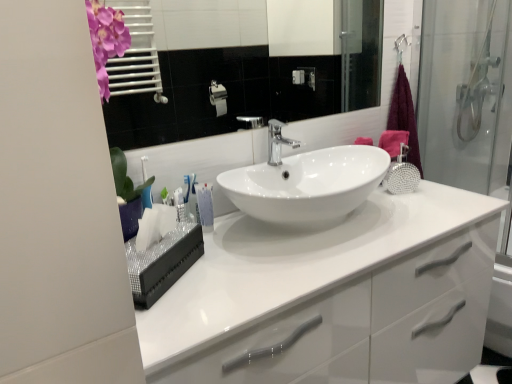
Question: Can you confirm if pink fabric bath towel at upper right is positioned to the left of white glossy cabinet at center?

Choices:
 (A) no
 (B) yes

Answer: (A)

Question: Is the depth of pink fabric bath towel at upper right less than that of white glossy cabinet at center?

Choices:
 (A) no
 (B) yes

Answer: (A)

Question: From the image's perspective, is pink fabric bath towel at upper right located above white glossy cabinet at center?

Choices:
 (A) yes
 (B) no

Answer: (A)

Question: From a real-world perspective, is pink fabric bath towel at upper right on top of white glossy cabinet at center?

Choices:
 (A) yes
 (B) no

Answer: (A)

Question: Can you confirm if pink fabric bath towel at upper right is taller than white glossy cabinet at center?

Choices:
 (A) no
 (B) yes

Answer: (A)

Question: Is pink fabric bath towel at upper right oriented away from white glossy cabinet at center?

Choices:
 (A) no
 (B) yes

Answer: (A)

Question: Can you confirm if white glossy tube at center is bigger than pink fabric bath towel at upper right?

Choices:
 (A) no
 (B) yes

Answer: (A)

Question: Could you tell me if white glossy tube at center is facing pink fabric bath towel at upper right?

Choices:
 (A) no
 (B) yes

Answer: (A)

Question: Is pink fabric bath towel at upper right surrounded by white glossy tube at center?

Choices:
 (A) no
 (B) yes

Answer: (A)

Question: Is white glossy tube at center placed right next to pink fabric bath towel at upper right?

Choices:
 (A) yes
 (B) no

Answer: (B)

Question: Can you confirm if white glossy tube at center is smaller than pink fabric bath towel at upper right?

Choices:
 (A) yes
 (B) no

Answer: (A)

Question: Does white glossy tube at center have a greater height compared to pink fabric bath towel at upper right?

Choices:
 (A) yes
 (B) no

Answer: (A)

Question: From a real-world perspective, is white glossy mirror at upper center physically above polished chrome tap at center?

Choices:
 (A) yes
 (B) no

Answer: (A)